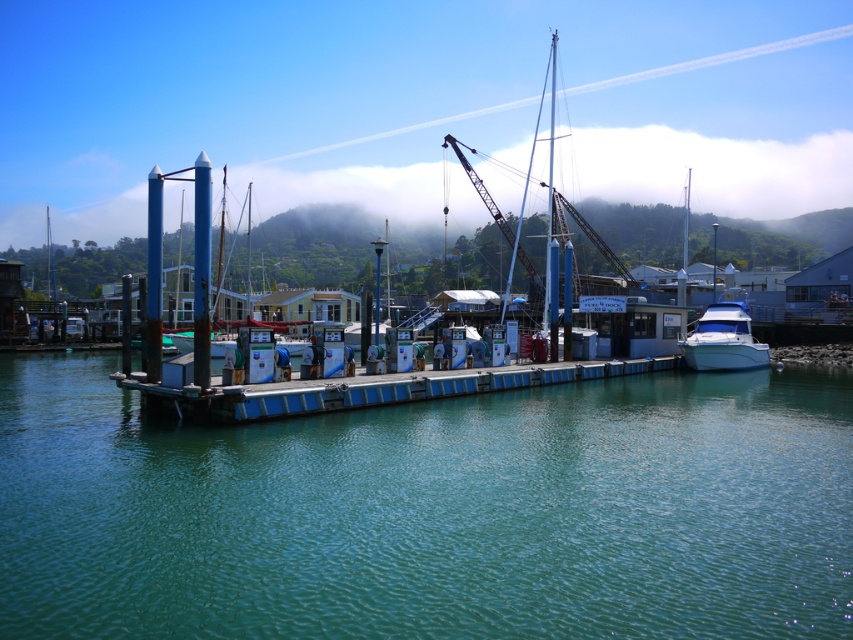
Which is more to the left, teal glossy water at center or white glossy boat at right?

teal glossy water at center is more to the left.

Which of these two, teal glossy water at center or white glossy boat at right, stands taller?

With more height is white glossy boat at right.

Is point (410, 477) more distant than point (688, 346)?

No, it is in front of (688, 346).

Identify the location of teal glossy water at center. (431, 512).

The image size is (853, 640). What do you see at coordinates (367, 390) in the screenshot?
I see `blue painted wood dock at center` at bounding box center [367, 390].

Which is in front, point (163, 410) or point (744, 323)?

Point (163, 410) is in front.

Where is `blue painted wood dock at center`? This screenshot has height=640, width=853. blue painted wood dock at center is located at coordinates (367, 390).

Can you confirm if foggy misty hillside at upper center is positioned to the left of blue painted wood dock at center?

Indeed, foggy misty hillside at upper center is positioned on the left side of blue painted wood dock at center.

Does foggy misty hillside at upper center have a greater width compared to blue painted wood dock at center?

Yes.

Measure the distance between foggy misty hillside at upper center and camera.

foggy misty hillside at upper center is 160.99 meters from camera.

The image size is (853, 640). Find the location of `foggy misty hillside at upper center`. foggy misty hillside at upper center is located at coordinates (709, 170).